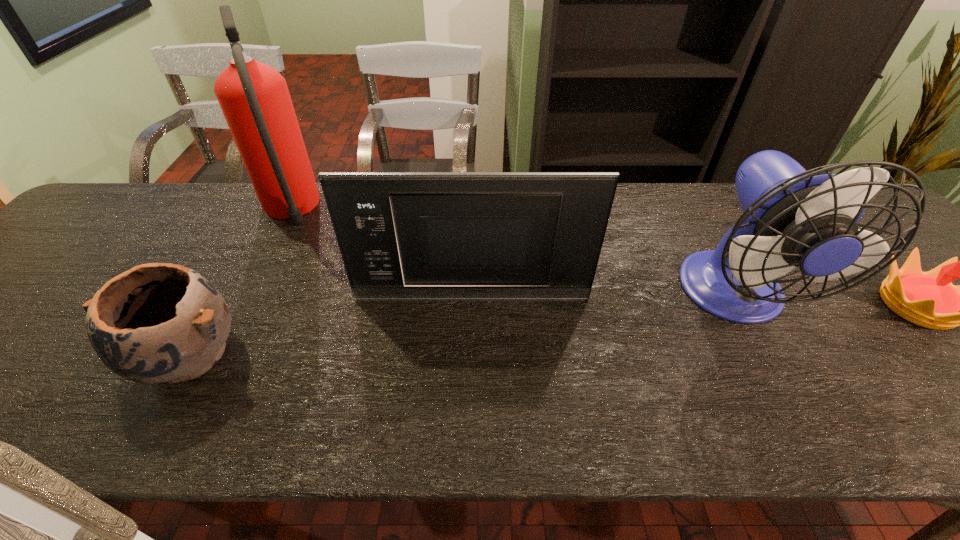
Where is `fire extinguisher`? fire extinguisher is located at coordinates (254, 98).

Where is `fan`? This screenshot has height=540, width=960. fan is located at coordinates (791, 218).

Locate an element on the screen. This screenshot has width=960, height=540. the second object from right to left is located at coordinates (791, 218).

Find the location of a particular element. This screenshot has width=960, height=540. the third object from left to right is located at coordinates (403, 236).

The width and height of the screenshot is (960, 540). What are the coordinates of `microwave oven` in the screenshot? It's located at (403, 236).

I want to click on pottery, so click(158, 322).

Locate an element on the screen. This screenshot has height=540, width=960. free space located 0.100m in front of the fourth shortest object where the airflow is directed is located at coordinates (788, 392).

Find the location of `vacant space located 0.320m on the front panel of the third object from right to left`. vacant space located 0.320m on the front panel of the third object from right to left is located at coordinates (469, 433).

Locate an element on the screen. vacant point located on the back of the second shortest object is located at coordinates (234, 276).

The image size is (960, 540). Find the location of `object located at the far edge`. object located at the far edge is located at coordinates (254, 98).